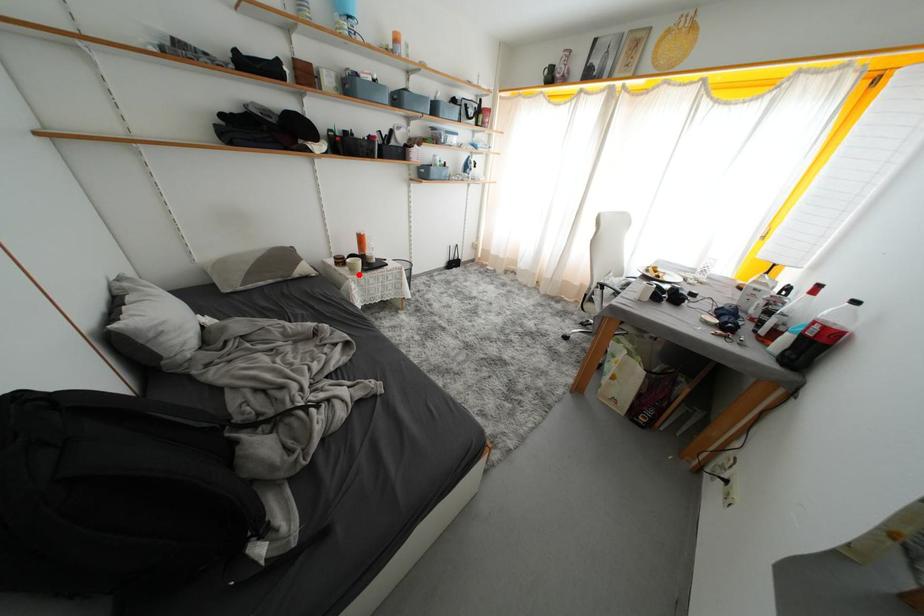
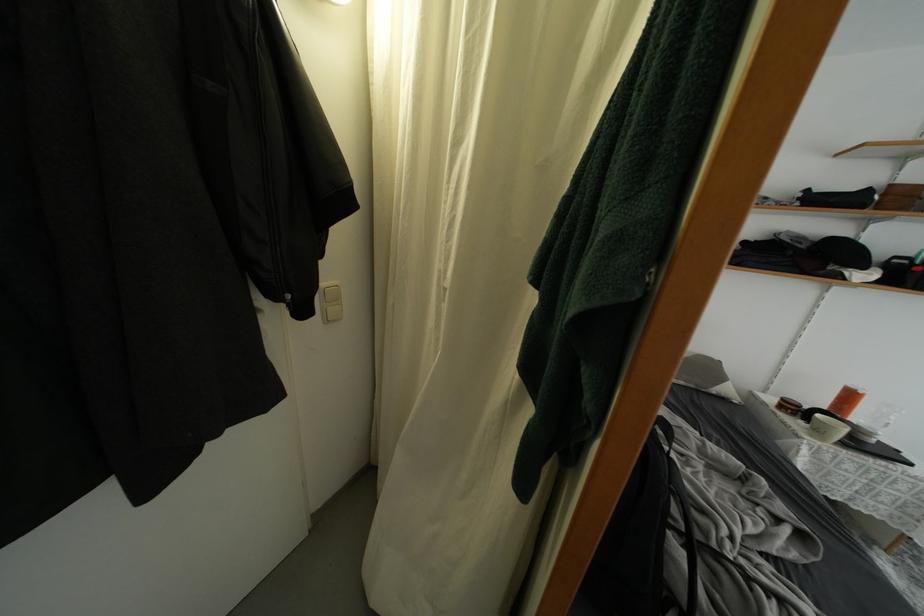
In the second image, find the point that corresponds to the highlighted location in the first image.

(823, 437)